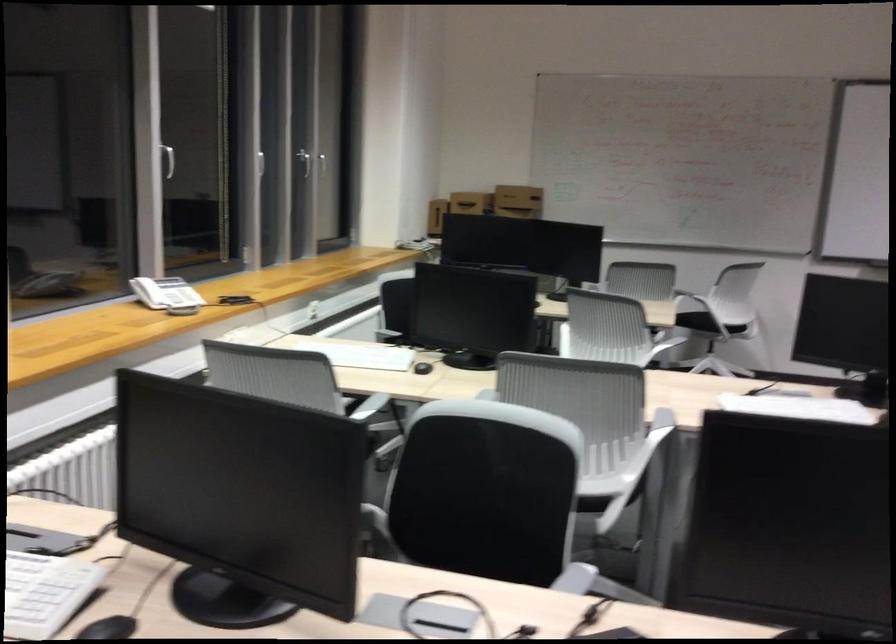
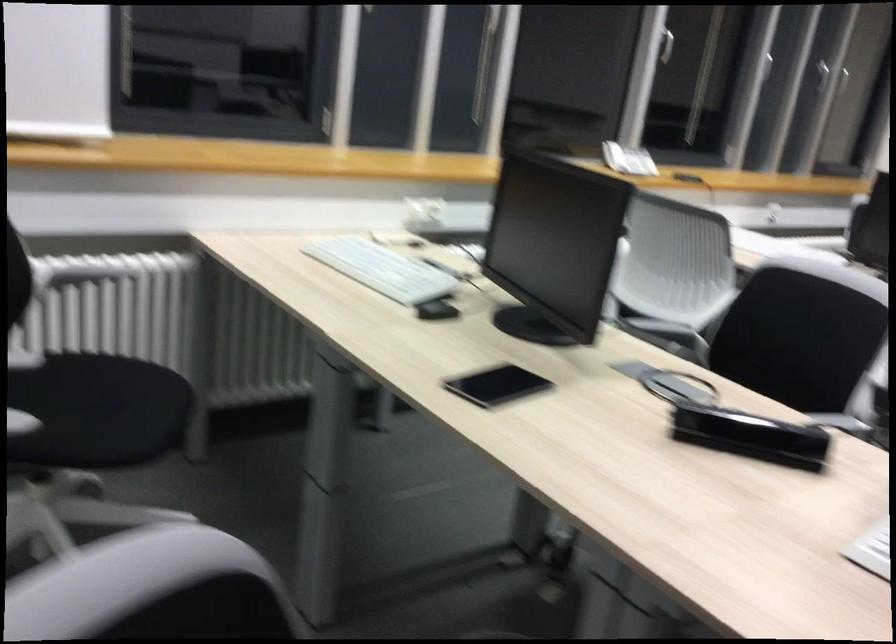
The point at (475, 487) is marked in the first image. Where is the corresponding point in the second image?

(798, 337)